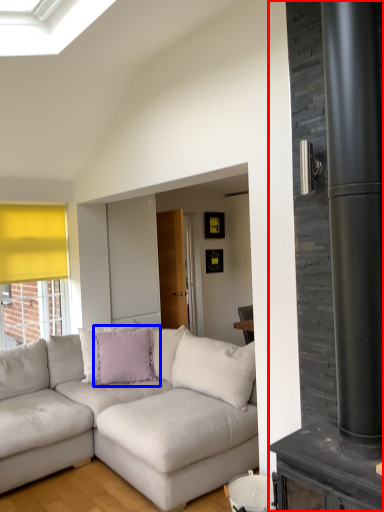
Question: Which object is closer to the camera taking this photo, fireplace (highlighted by a red box) or pillow (highlighted by a blue box)?

Choices:
 (A) fireplace
 (B) pillow

Answer: (A)